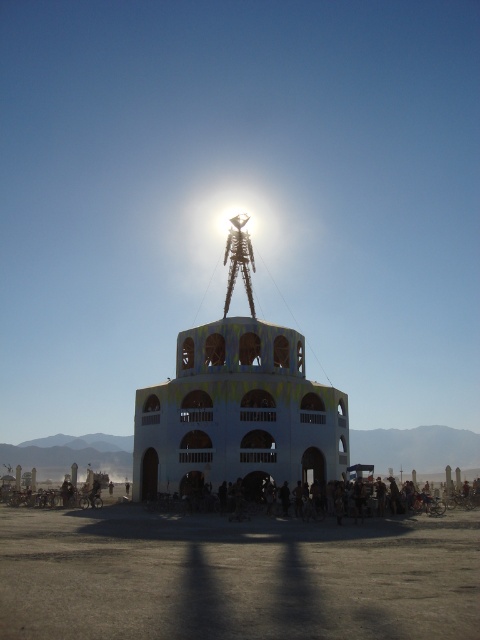
You are a visitor standing in front of the large cylindrical building. You notice the dirt field at center and the white painted wood tower at center. Which one is closer to the ground?

The dirt field at center is below the white painted wood tower at center, so the dirt field at center is closer to the ground.

What is the 2D coordinate of the dirt field at center?

The dirt field at center is located at the 2D coordinate point of (236, 576).

You are standing at the base of the cylindrical building and looking towards the skeletal figure. There are two points marked in the scene, point A at coordinates point (268, 554) and point B at coordinates point (219, 433). Which point is closer to you?

Point A at coordinates point (268, 554) is closer to you than point B at coordinates point (219, 433).